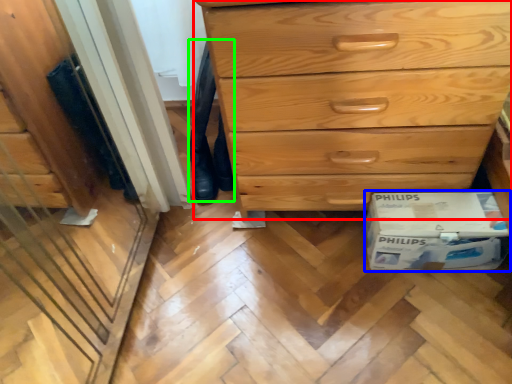
Question: Estimate the real-world distances between objects in this image. Which object is farther from chest of drawers (highlighted by a red box), cardboard box (highlighted by a blue box) or jeans (highlighted by a green box)?

Choices:
 (A) cardboard box
 (B) jeans

Answer: (B)